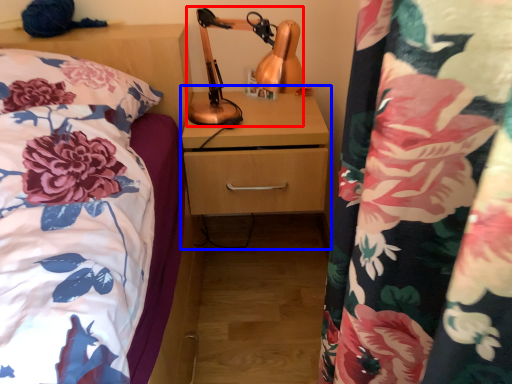
Question: Which object is further to the camera taking this photo, table lamp (highlighted by a red box) or dresser (highlighted by a blue box)?

Choices:
 (A) table lamp
 (B) dresser

Answer: (B)